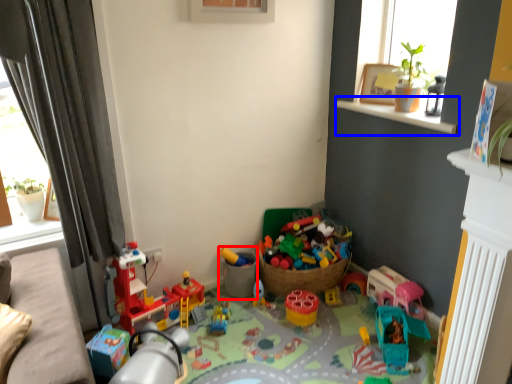
Question: Which of the following is the farthest to the observer, toy (highlighted by a red box) or window sill (highlighted by a blue box)?

Choices:
 (A) toy
 (B) window sill

Answer: (A)